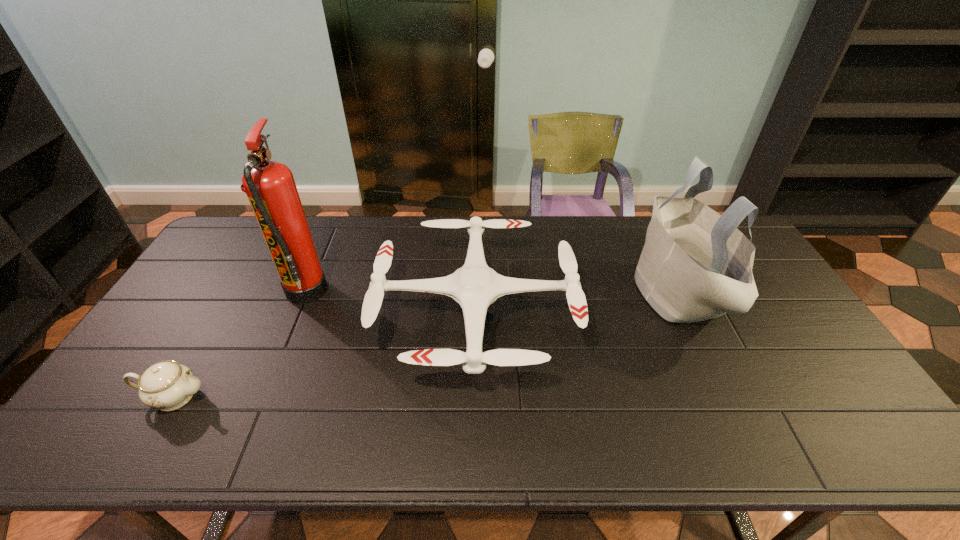
Find the location of a particular element. the tallest object is located at coordinates (270, 187).

Locate an element on the screen. The width and height of the screenshot is (960, 540). fire extinguisher is located at coordinates (270, 187).

The width and height of the screenshot is (960, 540). I want to click on the third shortest object, so click(x=695, y=265).

Image resolution: width=960 pixels, height=540 pixels. In order to click on shopping bag in this screenshot , I will do `click(695, 265)`.

This screenshot has width=960, height=540. Identify the location of the second object from right to left. coord(474,286).

This screenshot has width=960, height=540. Find the location of `drone`. drone is located at coordinates (474, 286).

Image resolution: width=960 pixels, height=540 pixels. What are the coordinates of `the shortest object` in the screenshot? It's located at (167, 385).

Where is `the leftmost object`? the leftmost object is located at coordinates (167, 385).

Where is `vacant region located 0.310m with the nozzle pointing from the back of the tallest object`? This screenshot has height=540, width=960. vacant region located 0.310m with the nozzle pointing from the back of the tallest object is located at coordinates pyautogui.click(x=426, y=291).

This screenshot has width=960, height=540. In order to click on blank space located on the left of the second tallest object in this screenshot , I will do `click(610, 293)`.